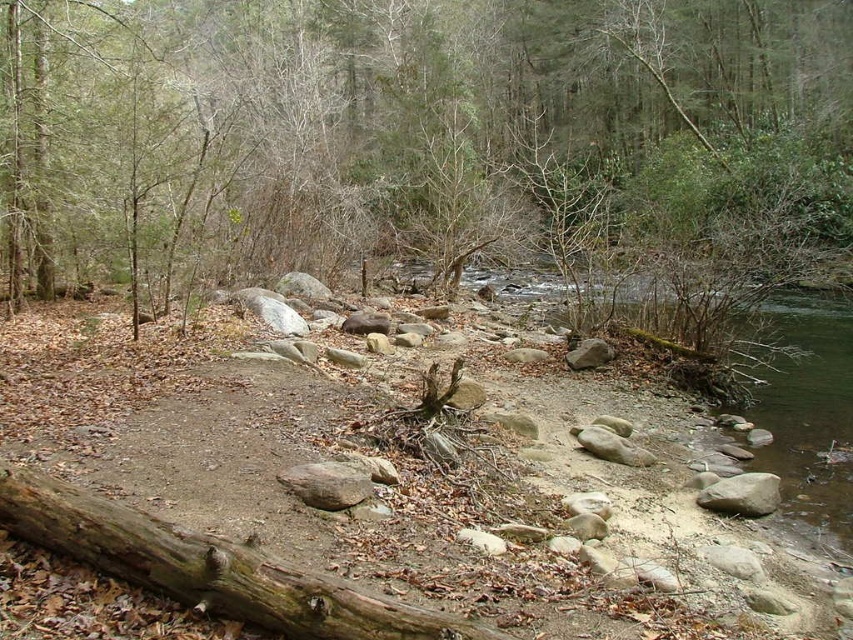
Which of these two, brown wood tree at center or weathered brown log at lower left, stands shorter?

With less height is weathered brown log at lower left.

Does brown wood tree at center appear over weathered brown log at lower left?

Yes, brown wood tree at center is above weathered brown log at lower left.

Where is `brown wood tree at center`? brown wood tree at center is located at coordinates (425, 141).